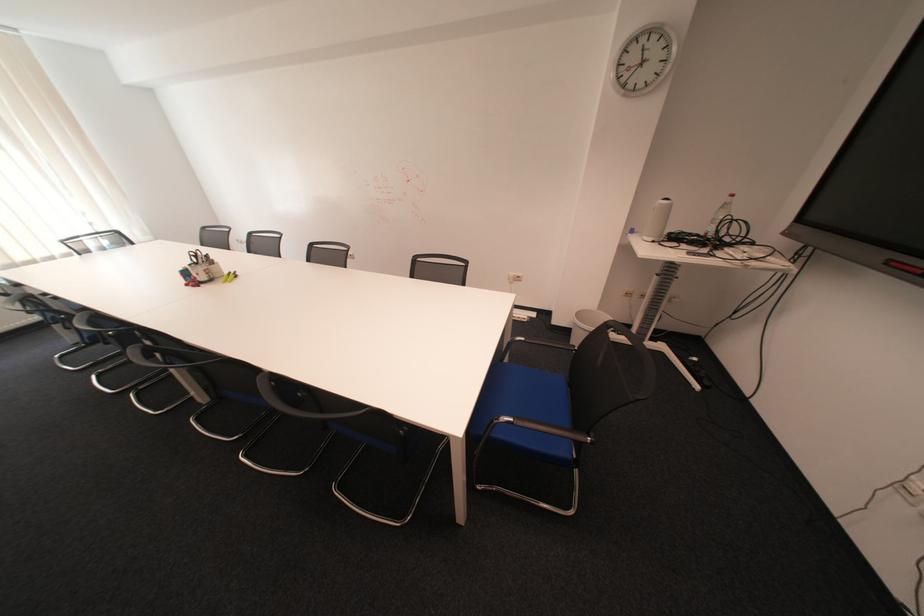
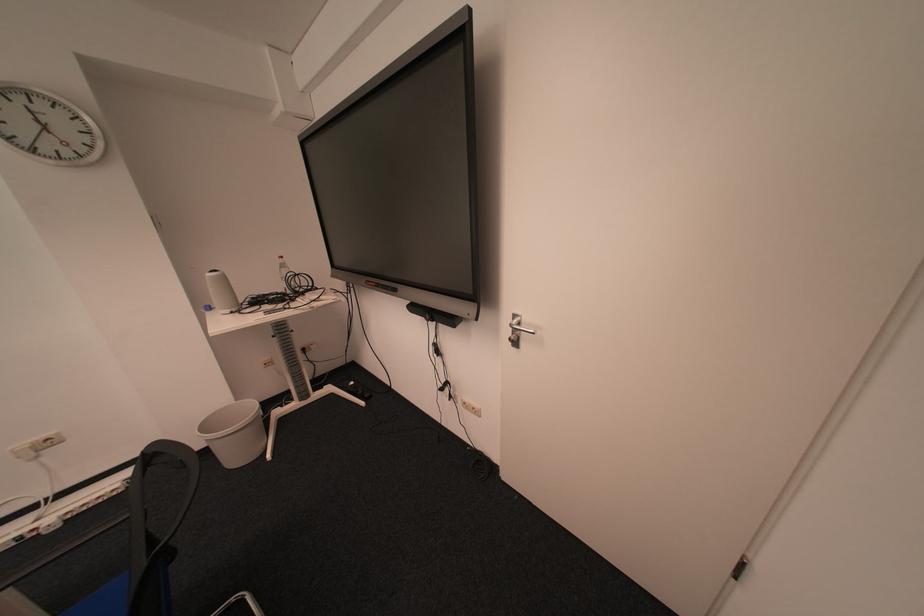
Where in the second image is the point corresponding to (643,232) from the first image?

(221, 309)